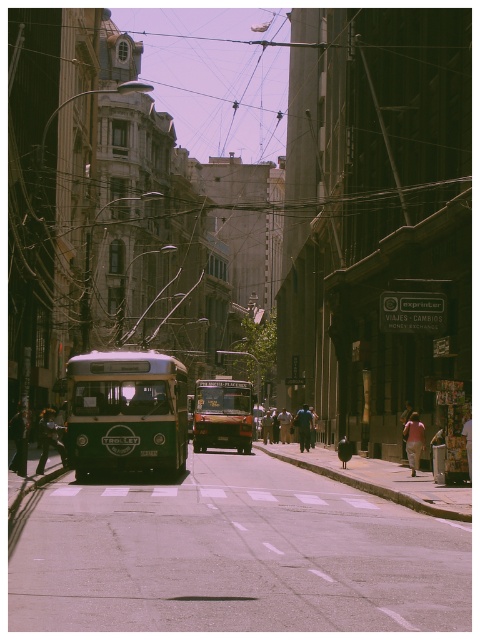
Does green matte trolley at center have a lesser width compared to metallic brown bus at center?

Yes.

Does point (115, 394) lie in front of point (216, 426)?

That is True.

Who is more distant from viewer, (75, 460) or (232, 432)?

The point (232, 432) is behind.

Image resolution: width=480 pixels, height=640 pixels. Identify the location of green matte trolley at center. (126, 412).